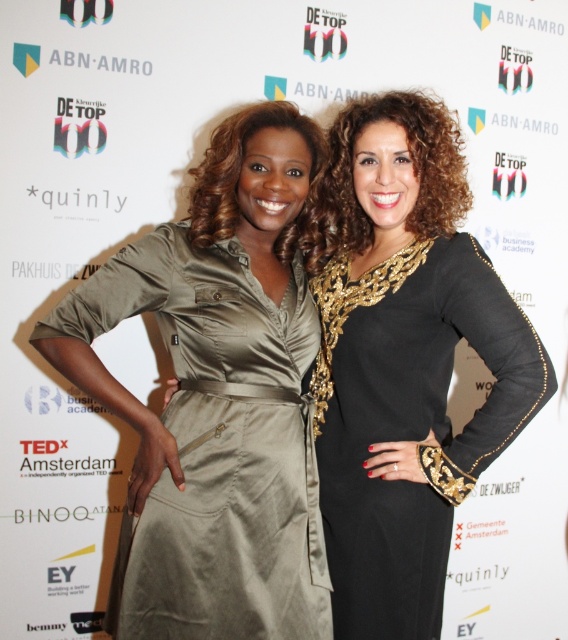
Question: From the image, what is the correct spatial relationship of satin olive dress at center in relation to black sequined dress at right?

Choices:
 (A) above
 (B) below

Answer: (A)

Question: Which object is closer to the camera taking this photo?

Choices:
 (A) black sequined dress at right
 (B) satin olive dress at center

Answer: (B)

Question: Does satin olive dress at center appear on the right side of black sequined dress at right?

Choices:
 (A) no
 (B) yes

Answer: (A)

Question: Which of the following is the closest to the observer?

Choices:
 (A) satin olive dress at center
 (B) black sequined dress at right

Answer: (A)

Question: Is satin olive dress at center wider than black sequined dress at right?

Choices:
 (A) no
 (B) yes

Answer: (B)